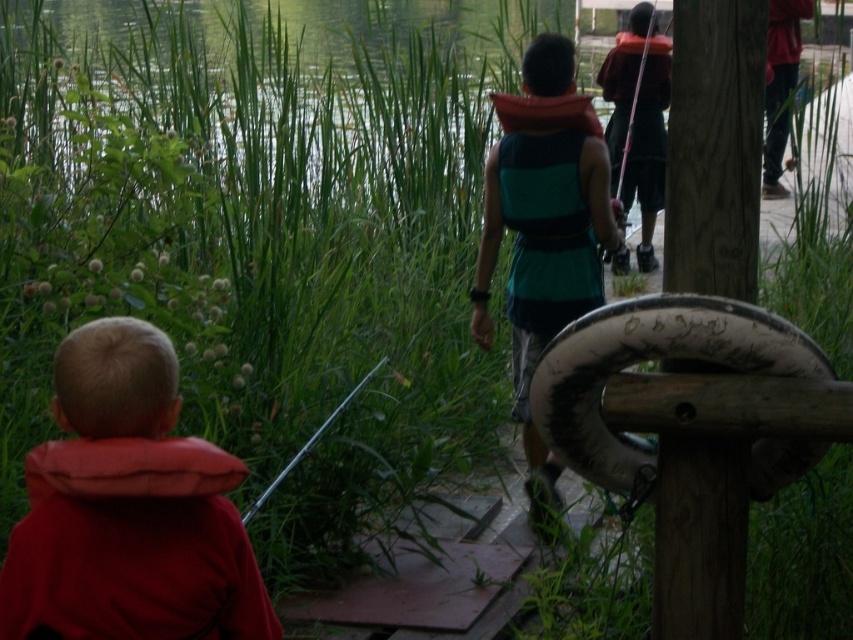
Between red soft vest at left and wooden post at right, which one has less height?

With less height is red soft vest at left.

Between red soft vest at left and wooden post at right, which one appears on the left side from the viewer's perspective?

red soft vest at left

Where is `red soft vest at left`? The image size is (853, 640). red soft vest at left is located at coordinates (128, 509).

Locate an element on the screen. This screenshot has height=640, width=853. red soft vest at left is located at coordinates (128, 509).

Is wooden post at right below teal fabric life vest at center?

Yes, wooden post at right is below teal fabric life vest at center.

Which is behind, point (704, 109) or point (546, 481)?

Point (546, 481)

Who is more distant from viewer, (x=724, y=444) or (x=529, y=141)?

The point (x=529, y=141) is more distant.

Locate an element on the screen. This screenshot has width=853, height=640. wooden post at right is located at coordinates (714, 147).

Does wooden post at right appear over metallic silver fishing pole at lower center?

Yes, wooden post at right is above metallic silver fishing pole at lower center.

Is wooden post at right below metallic silver fishing pole at lower center?

Incorrect, wooden post at right is not positioned below metallic silver fishing pole at lower center.

Is point (682, 68) farther from viewer compared to point (245, 516)?

No, (682, 68) is closer to viewer.

This screenshot has width=853, height=640. In order to click on wooden post at right in this screenshot , I will do `click(714, 147)`.